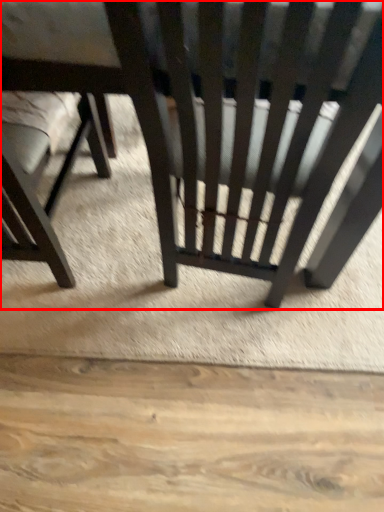
Question: Considering the relative positions of chair (annotated by the red box) and chair in the image provided, where is chair (annotated by the red box) located with respect to the staircase?

Choices:
 (A) left
 (B) right

Answer: (B)